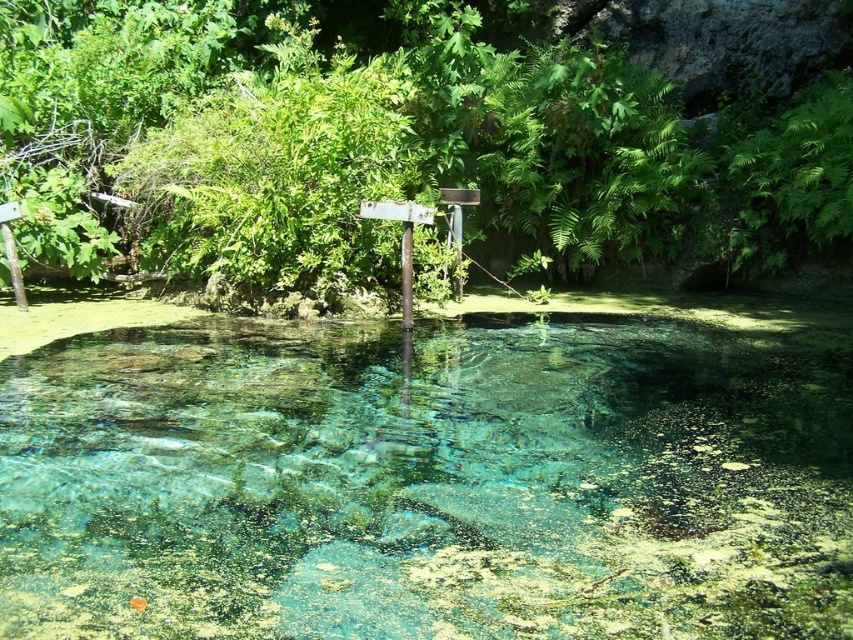
Question: Which object is the closest to the clear glass pool at center?

Choices:
 (A) metallic pole at center
 (B) green leafy tree at center

Answer: (A)

Question: Among these points, which one is farthest from the camera?

Choices:
 (A) (149, 161)
 (B) (802, 618)
 (C) (401, 240)

Answer: (A)

Question: Is green leafy tree at center closer to the viewer compared to metallic pole at center?

Choices:
 (A) yes
 (B) no

Answer: (B)

Question: Does clear glass pool at center appear under green leafy tree at center?

Choices:
 (A) no
 (B) yes

Answer: (B)

Question: Which point appears closest to the camera in this image?

Choices:
 (A) (410, 305)
 (B) (457, 19)

Answer: (A)

Question: Does green leafy tree at center appear on the right side of metallic pole at center?

Choices:
 (A) no
 (B) yes

Answer: (B)